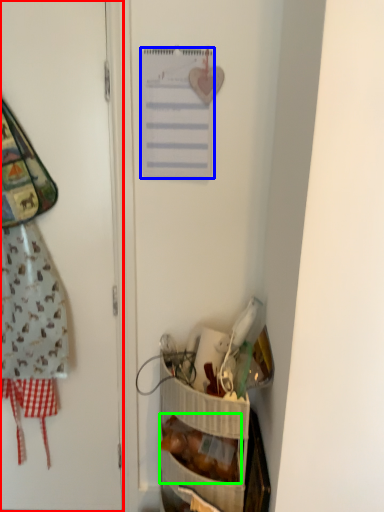
Question: Considering the real-world distances, which object is farthest from door (highlighted by a red box)? list (highlighted by a blue box) or food (highlighted by a green box)?

Choices:
 (A) list
 (B) food

Answer: (B)